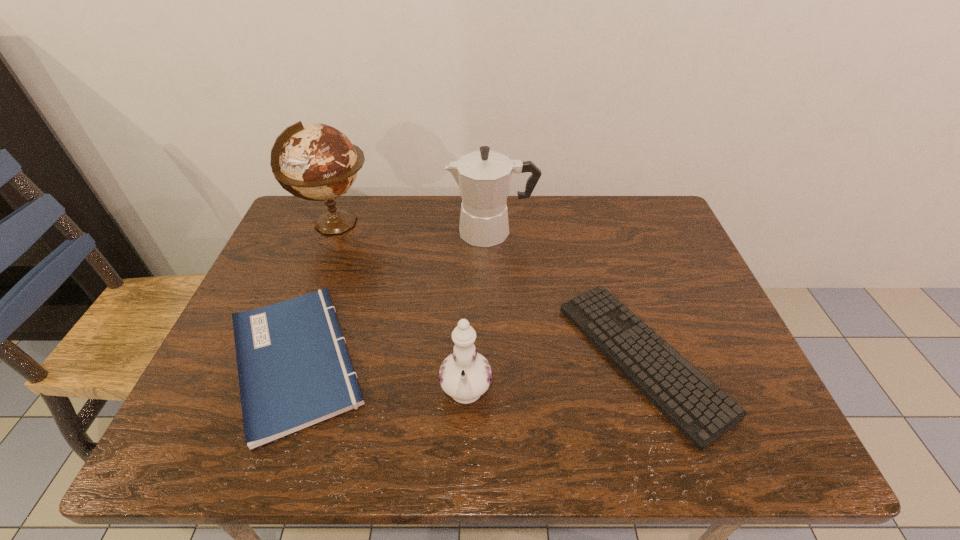
Locate an element on the screen. The height and width of the screenshot is (540, 960). the tallest object is located at coordinates (318, 162).

At what (x,y) coordinates should I click in order to perform the action: click on the fourth shortest object. Please return your answer as a coordinate pair (x, y). This screenshot has width=960, height=540. Looking at the image, I should click on (483, 177).

At what (x,y) coordinates should I click in order to perform the action: click on chinaware. Please return your answer as a coordinate pair (x, y). Looking at the image, I should click on (465, 375).

The width and height of the screenshot is (960, 540). I want to click on the fourth tallest object, so click(294, 370).

Locate an element on the screen. computer keyboard is located at coordinates (702, 412).

This screenshot has width=960, height=540. What are the coordinates of `the shortest object` in the screenshot? It's located at (702, 412).

Identify the location of vacant position located on the front of the globe showing Asia. click(419, 224).

Find the location of a particular element. The width and height of the screenshot is (960, 540). vacant space located 0.100m at the spout of the coffeepot is located at coordinates (416, 232).

This screenshot has height=540, width=960. Find the location of `vacant area situated 0.320m at the spout of the coffeepot`. vacant area situated 0.320m at the spout of the coffeepot is located at coordinates (342, 232).

The width and height of the screenshot is (960, 540). I want to click on free location located 0.160m at the spout of the coffeepot, so click(x=396, y=232).